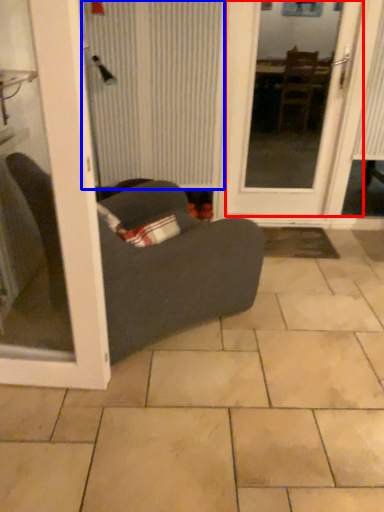
Question: Which point is further to the camera, door (highlighted by a red box) or curtain (highlighted by a blue box)?

Choices:
 (A) door
 (B) curtain

Answer: (B)